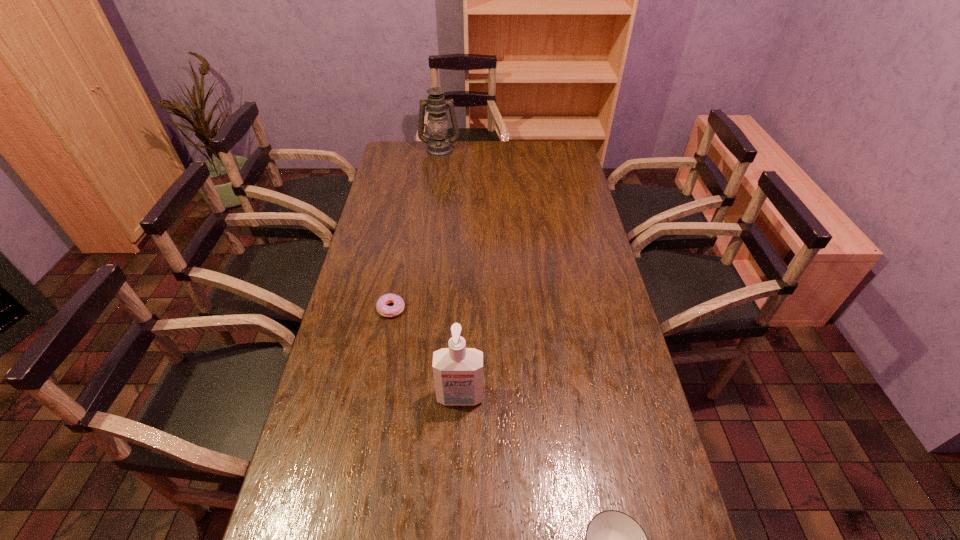
Locate an element on the screen. This screenshot has height=540, width=960. oil lamp is located at coordinates (439, 145).

Locate an element on the screen. This screenshot has height=540, width=960. the third farthest object is located at coordinates (458, 371).

Locate an element on the screen. This screenshot has width=960, height=540. the shortest object is located at coordinates (387, 311).

Find the location of a particular element. The width and height of the screenshot is (960, 540). the third nearest object is located at coordinates (387, 311).

You are a GUI agent. You are given a task and a screenshot of the screen. Output one action in this format:
    pyautogui.click(x=<x>, y=<y>)
    Task: Click on the vacant position located 0.200m on the front of the farthest object
    This screenshot has height=540, width=960.
    Given the screenshot: What is the action you would take?
    pyautogui.click(x=436, y=180)

Where is `free space located 0.250m on the front label of the cleansing agent`? free space located 0.250m on the front label of the cleansing agent is located at coordinates (456, 513).

I want to click on vacant space situated 0.350m on the right of the third nearest object, so click(514, 308).

Where is `object that is at the far edge`? The width and height of the screenshot is (960, 540). object that is at the far edge is located at coordinates (439, 145).

I want to click on oil lamp situated at the left edge, so click(x=439, y=145).

Where is `doughnut situated at the left edge`? The height and width of the screenshot is (540, 960). doughnut situated at the left edge is located at coordinates (387, 311).